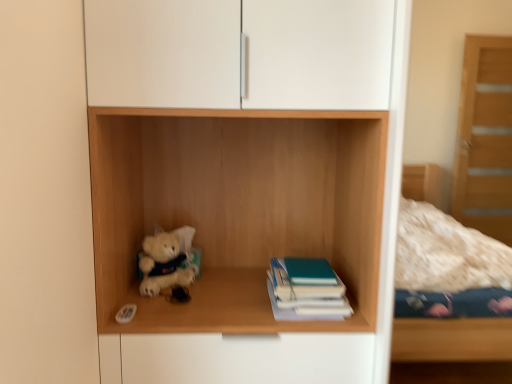
Identify the location of free location in front of fluffy white teddy bear at lower left. The width and height of the screenshot is (512, 384). (167, 311).